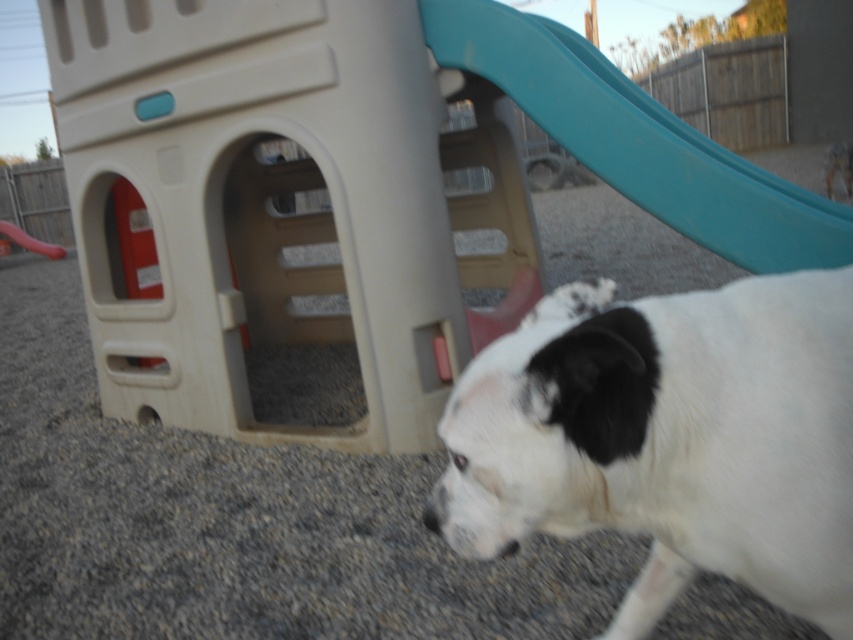
Does point (457, 451) come behind point (422, 518)?

No, it is not.

What do you see at coordinates (669, 438) in the screenshot? The width and height of the screenshot is (853, 640). I see `white fur dog at lower right` at bounding box center [669, 438].

You are a GUI agent. You are given a task and a screenshot of the screen. Output one action in this format:
    pyautogui.click(x=<x>, y=<y>)
    Task: Click on the white fur dog at lower right
    The image size is (853, 640).
    Given the screenshot: What is the action you would take?
    pyautogui.click(x=669, y=438)

Looking at this image, who is more forward, (773,557) or (567,28)?

Positioned in front is point (773,557).

Between point (727, 385) and point (676, 198), which one is positioned behind?

The point (676, 198) is more distant.

Between point (619, 628) and point (466, 65), which one is positioned behind?

The point (466, 65) is behind.

You are a GUI agent. You are given a task and a screenshot of the screen. Output one action in this format:
    pyautogui.click(x=<x>, y=<y>)
    Task: Click on the white fur dog at lower right
    The height and width of the screenshot is (640, 853).
    Given the screenshot: What is the action you would take?
    pyautogui.click(x=669, y=438)

Who is lower down, beige plastic playhouse at center or rubberized red slide at center?

Positioned lower is beige plastic playhouse at center.

You are a GUI agent. You are given a task and a screenshot of the screen. Output one action in this format:
    pyautogui.click(x=<x>, y=<y>)
    Task: Click on the beige plastic playhouse at center
    This screenshot has width=853, height=640.
    Given the screenshot: What is the action you would take?
    pyautogui.click(x=277, y=204)

Identify the location of beige plastic playhouse at center. (277, 204).